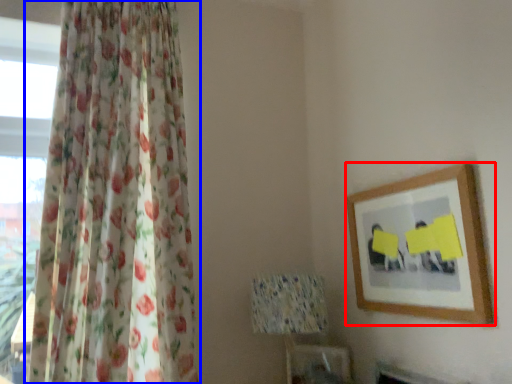
Question: Which object is further to the camera taking this photo, picture frame (highlighted by a red box) or curtain (highlighted by a blue box)?

Choices:
 (A) picture frame
 (B) curtain

Answer: (A)